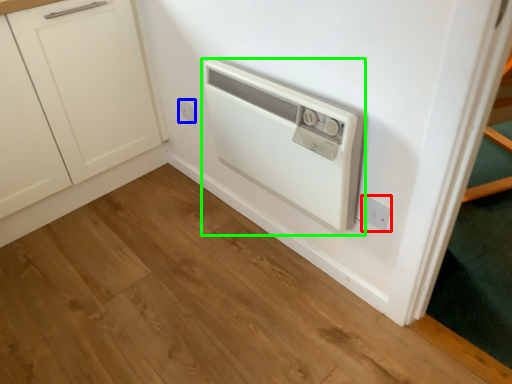
Question: Considering the real-world distances, which object is farthest from electric outlet (highlighted by a red box)? electric outlet (highlighted by a blue box) or home appliance (highlighted by a green box)?

Choices:
 (A) electric outlet
 (B) home appliance

Answer: (A)